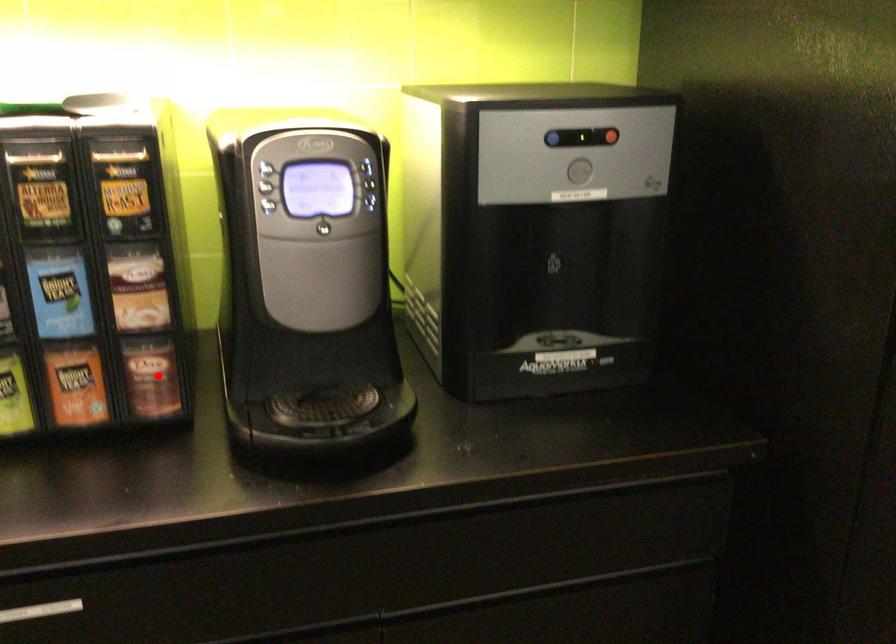
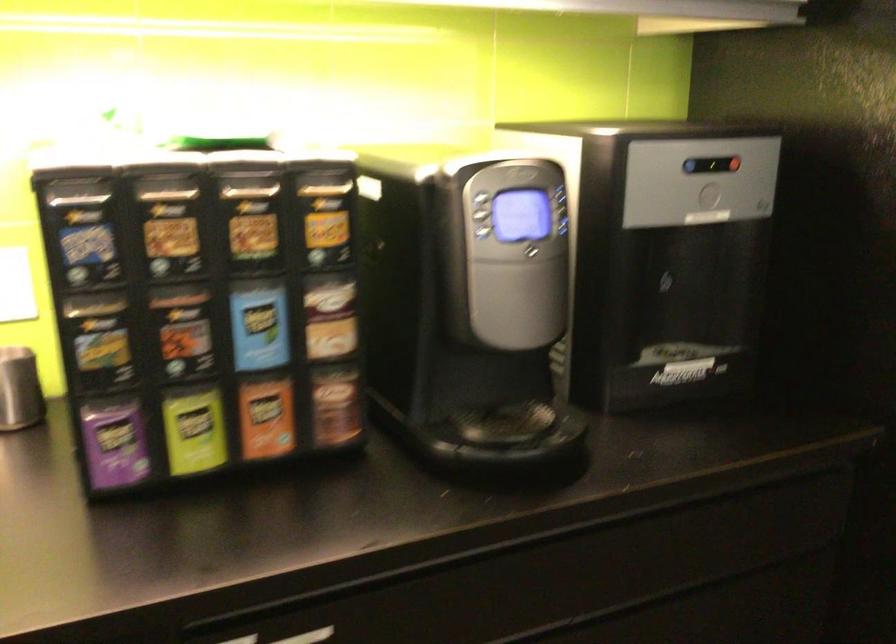
Find the pixel in the second image that matches the highlighted location in the first image.

(336, 406)